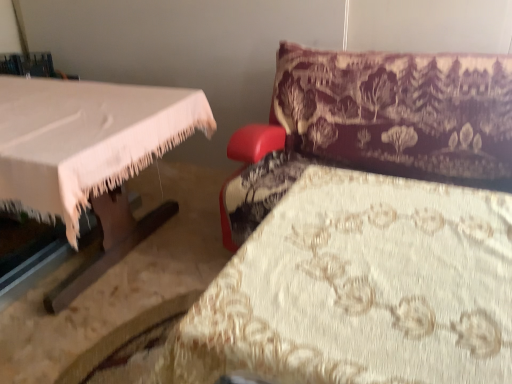
What is the approximate height of floral cream fabric at lower right?

floral cream fabric at lower right is 29.85 inches tall.

I want to click on floral cream fabric at lower right, so click(x=360, y=288).

The height and width of the screenshot is (384, 512). What do you see at coordinates (360, 288) in the screenshot?
I see `floral cream fabric at lower right` at bounding box center [360, 288].

In order to face floral cream fabric at lower right, should I rotate leftwards or rightwards?

To face it directly, rotate right by 15.237 degrees.

You are a GUI agent. You are given a task and a screenshot of the screen. Output one action in this format:
    pyautogui.click(x=<x>, y=<y>)
    Task: Click on the velvet-like burgundy couch at upper right
    Image resolution: width=512 pixels, height=384 pixels.
    Given the screenshot: What is the action you would take?
    pyautogui.click(x=372, y=125)

The image size is (512, 384). Describe the element at coordinates (372, 125) in the screenshot. I see `velvet-like burgundy couch at upper right` at that location.

What is the approximate width of velvet-like burgundy couch at upper right?

velvet-like burgundy couch at upper right is 38.40 inches wide.

The image size is (512, 384). I want to click on floral cream fabric at lower right, so point(360,288).

Can you confirm if velvet-like burgundy couch at upper right is positioned to the right of floral cream fabric at lower right?

Indeed, velvet-like burgundy couch at upper right is positioned on the right side of floral cream fabric at lower right.

Is velvet-like burgundy couch at upper right in front of or behind floral cream fabric at lower right in the image?

Visually, velvet-like burgundy couch at upper right is located behind floral cream fabric at lower right.

Which is further, [508,92] or [459,268]?

The point [508,92] is farther from the camera.

From the image's perspective, relative to floral cream fabric at lower right, is velvet-like burgundy couch at upper right above or below?

From the image's perspective, velvet-like burgundy couch at upper right appears above floral cream fabric at lower right.

From a real-world perspective, is velvet-like burgundy couch at upper right above or below floral cream fabric at lower right?

velvet-like burgundy couch at upper right is above floral cream fabric at lower right.

Consider the image. Does velvet-like burgundy couch at upper right have a lesser width compared to floral cream fabric at lower right?

In fact, velvet-like burgundy couch at upper right might be wider than floral cream fabric at lower right.

From their relative heights in the image, would you say velvet-like burgundy couch at upper right is taller or shorter than floral cream fabric at lower right?

Clearly, velvet-like burgundy couch at upper right is shorter compared to floral cream fabric at lower right.

Considering the relative sizes of velvet-like burgundy couch at upper right and floral cream fabric at lower right in the image provided, is velvet-like burgundy couch at upper right smaller than floral cream fabric at lower right?

No.

Is velvet-like burgundy couch at upper right inside the boundaries of floral cream fabric at lower right, or outside?

velvet-like burgundy couch at upper right cannot be found inside floral cream fabric at lower right.

Is velvet-like burgundy couch at upper right with floral cream fabric at lower right?

No, velvet-like burgundy couch at upper right is not in contact with floral cream fabric at lower right.

Is velvet-like burgundy couch at upper right aimed at floral cream fabric at lower right?

Yes.

Can you tell me how much velvet-like burgundy couch at upper right and floral cream fabric at lower right differ in facing direction?

velvet-like burgundy couch at upper right and floral cream fabric at lower right are facing 1.47e-05 degrees away from each other.

How distant is velvet-like burgundy couch at upper right from floral cream fabric at lower right?

A distance of 34.06 inches exists between velvet-like burgundy couch at upper right and floral cream fabric at lower right.

You are a GUI agent. You are given a task and a screenshot of the screen. Output one action in this format:
    pyautogui.click(x=<x>, y=<y>)
    Task: Click on the sheet that is under the velvet-like burgundy couch at upper right (from a real-world perspective)
    The image size is (512, 384).
    Given the screenshot: What is the action you would take?
    pyautogui.click(x=360, y=288)

Considering the positions of objects floral cream fabric at lower right and velvet-like burgundy couch at upper right in the image provided, who is more to the left, floral cream fabric at lower right or velvet-like burgundy couch at upper right?

From the viewer's perspective, floral cream fabric at lower right appears more on the left side.

Relative to velvet-like burgundy couch at upper right, is floral cream fabric at lower right in front or behind?

In the image, floral cream fabric at lower right appears in front of velvet-like burgundy couch at upper right.

Does point (351, 363) come in front of point (421, 113)?

Yes.

From the image's perspective, between floral cream fabric at lower right and velvet-like burgundy couch at upper right, who is located below?

From the image's view, floral cream fabric at lower right is below.

From a real-world perspective, between floral cream fabric at lower right and velvet-like burgundy couch at upper right, who is vertically higher?

velvet-like burgundy couch at upper right.

Considering the sizes of objects floral cream fabric at lower right and velvet-like burgundy couch at upper right in the image provided, who is thinner, floral cream fabric at lower right or velvet-like burgundy couch at upper right?

Thinner between the two is floral cream fabric at lower right.

Between floral cream fabric at lower right and velvet-like burgundy couch at upper right, which one has more height?

floral cream fabric at lower right is taller.

Considering the relative sizes of floral cream fabric at lower right and velvet-like burgundy couch at upper right in the image provided, is floral cream fabric at lower right smaller than velvet-like burgundy couch at upper right?

Yes, floral cream fabric at lower right is smaller than velvet-like burgundy couch at upper right.

Do you think floral cream fabric at lower right is within velvet-like burgundy couch at upper right, or outside of it?

floral cream fabric at lower right exists outside the volume of velvet-like burgundy couch at upper right.

Is floral cream fabric at lower right next to velvet-like burgundy couch at upper right and touching it?

floral cream fabric at lower right and velvet-like burgundy couch at upper right are not in contact.

Is floral cream fabric at lower right oriented away from velvet-like burgundy couch at upper right?

Yes, floral cream fabric at lower right's orientation is away from velvet-like burgundy couch at upper right.

Can you tell me how much floral cream fabric at lower right and velvet-like burgundy couch at upper right differ in facing direction?

The facing directions of floral cream fabric at lower right and velvet-like burgundy couch at upper right are 1.47e-05 degrees apart.

Where is `sheet in front of the velvet-like burgundy couch at upper right`? The image size is (512, 384). sheet in front of the velvet-like burgundy couch at upper right is located at coordinates (360, 288).

Find the location of `furniture above the floral cream fabric at lower right (from the image's perspective)`. furniture above the floral cream fabric at lower right (from the image's perspective) is located at coordinates (372, 125).

This screenshot has height=384, width=512. In order to click on furniture above the floral cream fabric at lower right (from a real-world perspective) in this screenshot , I will do `click(372, 125)`.